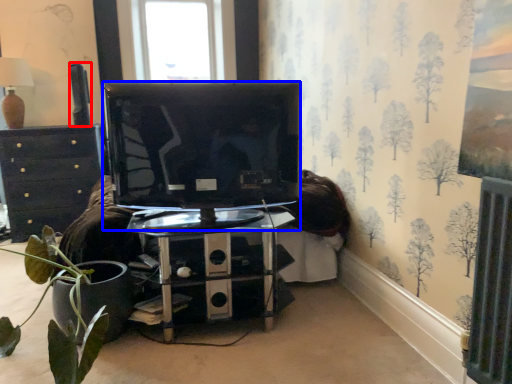
Question: Which of the following is the closest to the observer, speaker (highlighted by a red box) or television (highlighted by a blue box)?

Choices:
 (A) speaker
 (B) television

Answer: (B)